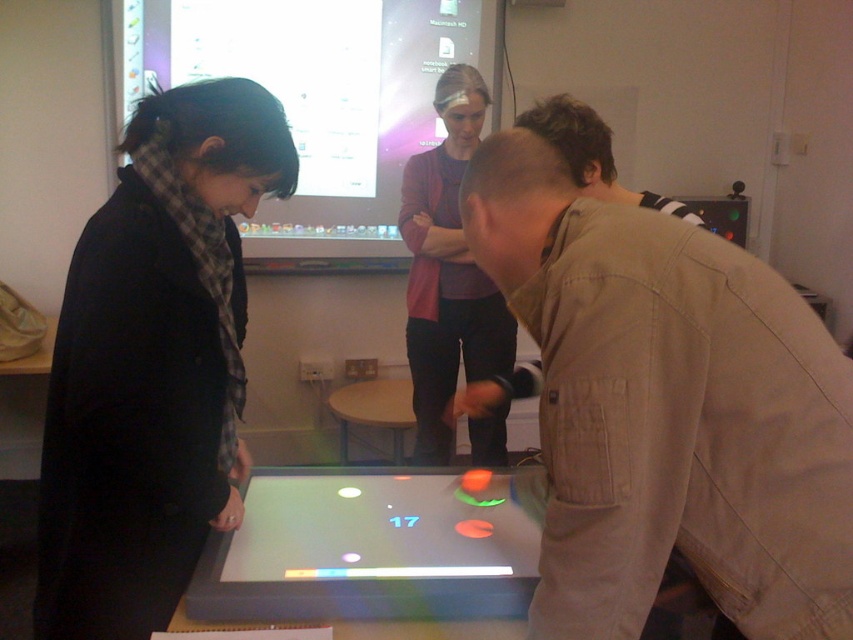
Who is taller, black woolen scarf at left or matte black screen at upper center?

With more height is matte black screen at upper center.

Who is shorter, black woolen scarf at left or matte black screen at upper center?

black woolen scarf at left is shorter.

Between point (71, 632) and point (154, 74), which one is positioned behind?

The point (154, 74) is more distant.

Find the location of a particular element. Image resolution: width=853 pixels, height=640 pixels. black woolen scarf at left is located at coordinates (154, 362).

Between khaki cotton shirt at center and translucent plastic table at center, which one has more height?

khaki cotton shirt at center is taller.

Is point (529, 252) less distant than point (427, 474)?

Yes, point (529, 252) is in front of point (427, 474).

This screenshot has height=640, width=853. I want to click on khaki cotton shirt at center, so click(668, 410).

Which is above, black woolen scarf at left or translucent plastic table at center?

black woolen scarf at left is higher up.

Does black woolen scarf at left have a greater height compared to translucent plastic table at center?

Yes.

Locate an element on the screen. The height and width of the screenshot is (640, 853). black woolen scarf at left is located at coordinates (154, 362).